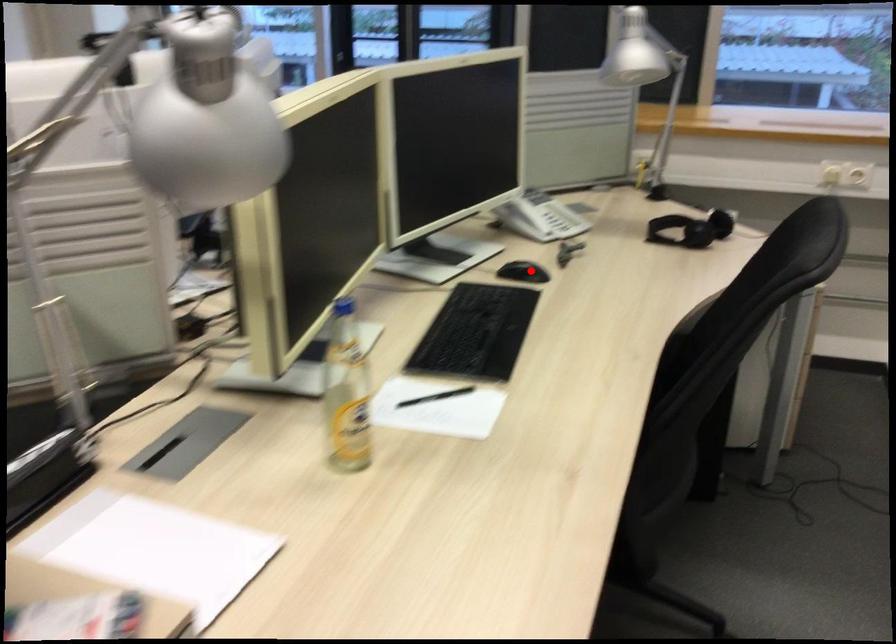
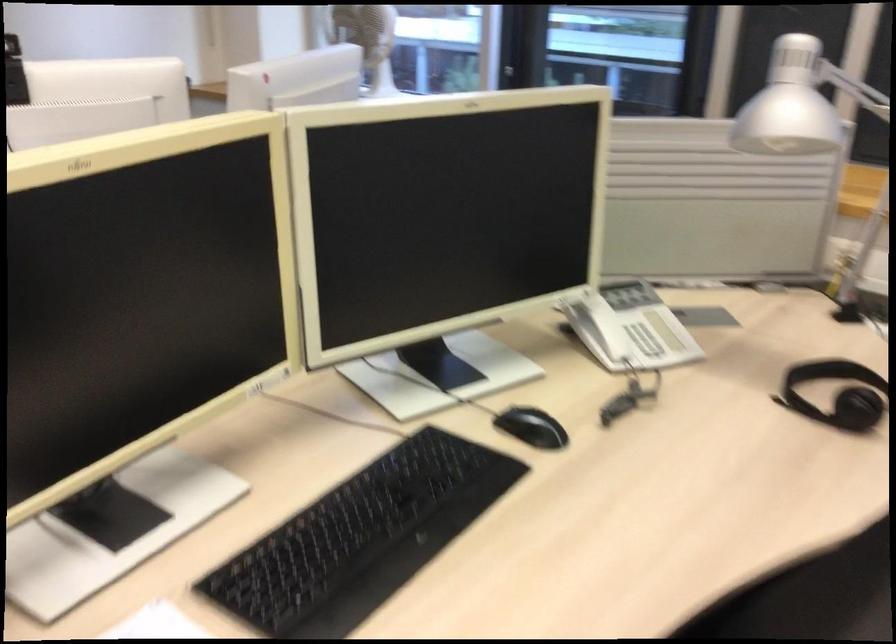
Find the pixel in the second image that matches the highlighted location in the first image.

(531, 427)